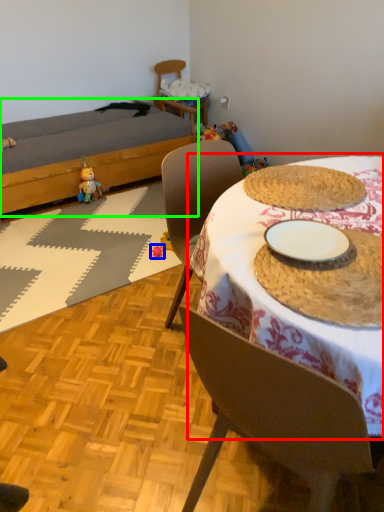
Question: Estimate the real-world distances between objects in this image. Which object is closer to table (highlighted by a red box), toy (highlighted by a blue box) or bed (highlighted by a green box)?

Choices:
 (A) toy
 (B) bed

Answer: (A)